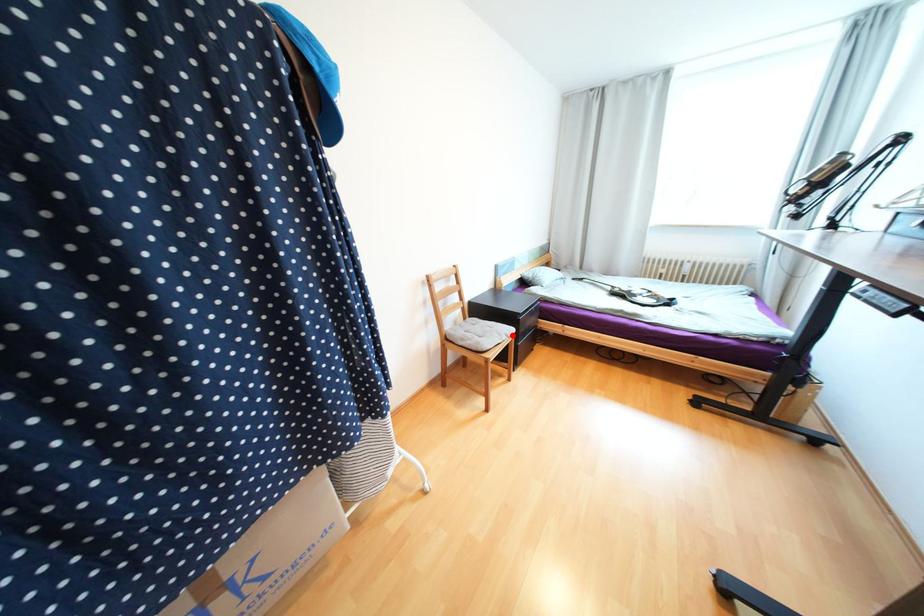
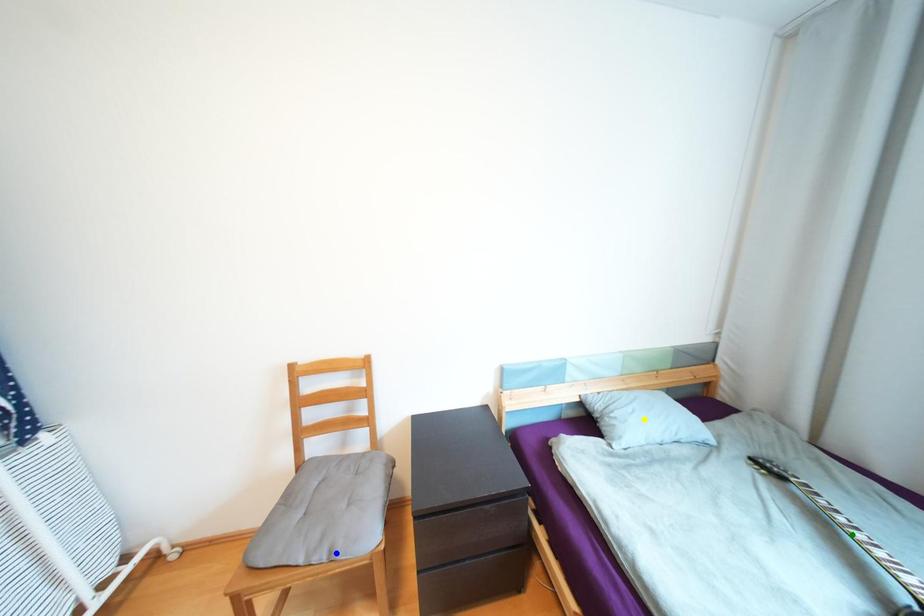
Question: I am providing you with two images of the same scene from different viewpoints. A red point is marked on the first image. You are given multiple points on the second image. In image 2, which mark is for the same physical point as the one in image 1?

Choices:
 (A) blue point
 (B) yellow point
 (C) green point

Answer: (A)